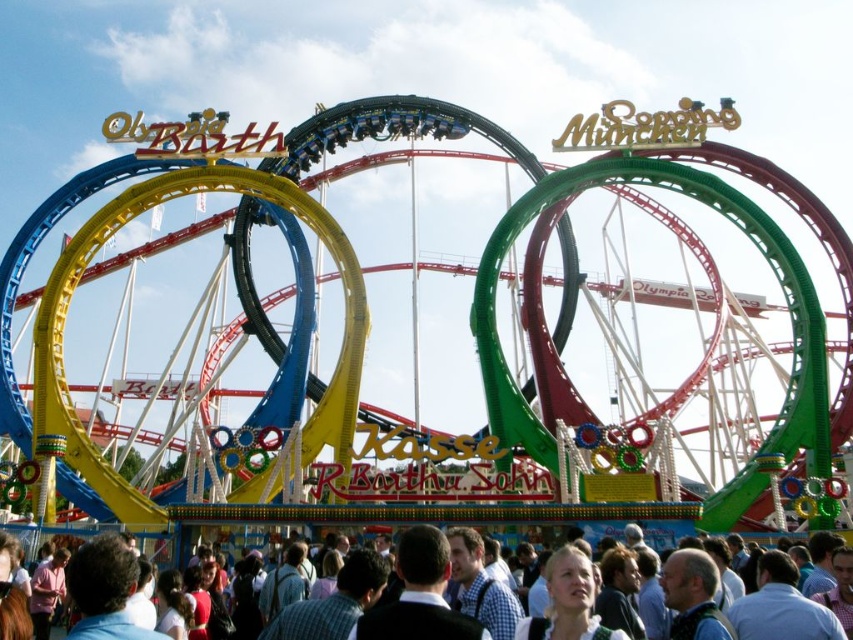
Does metallic roller coaster at center have a larger size compared to matte white crowd at lower center?

Yes, metallic roller coaster at center is bigger than matte white crowd at lower center.

Is point (15, 433) closer to viewer compared to point (38, 531)?

No, (15, 433) is further to viewer.

In order to click on metallic roller coaster at center in this screenshot , I will do `click(387, 131)`.